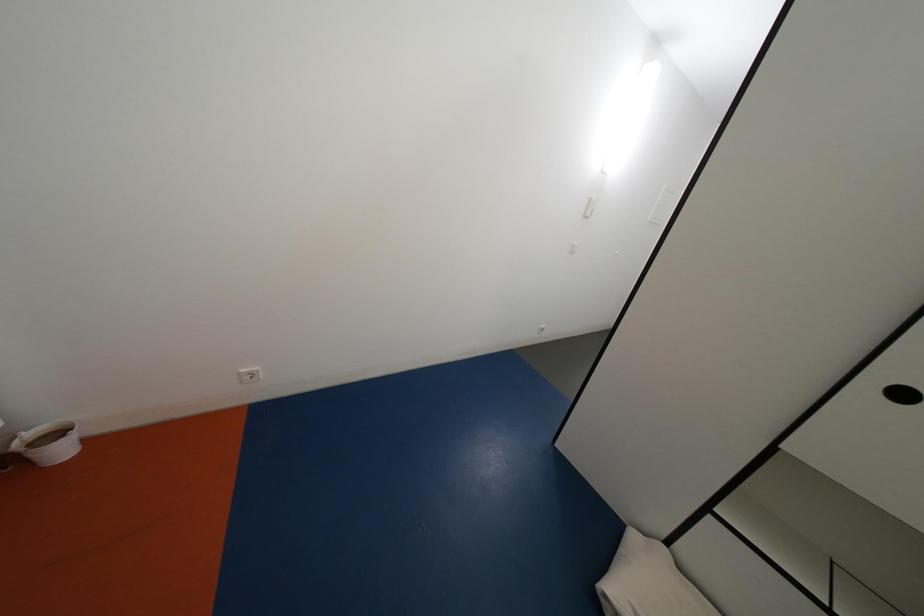
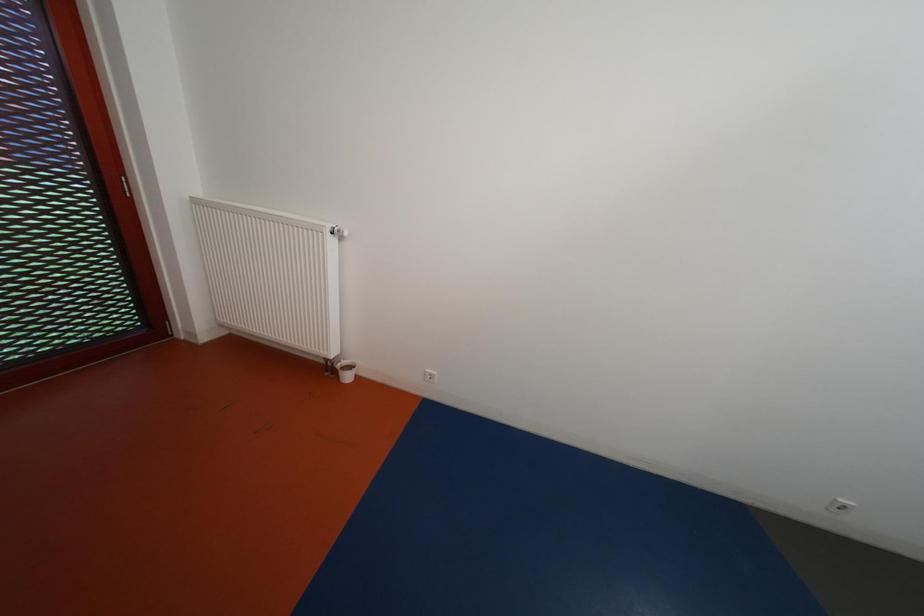
Question: The camera is either moving clockwise (left) or counter-clockwise (right) around the object. The first image is from the beginning of the video and the second image is from the end. Is the camera moving left or right when shooting the video?

Choices:
 (A) Left
 (B) Right

Answer: (B)